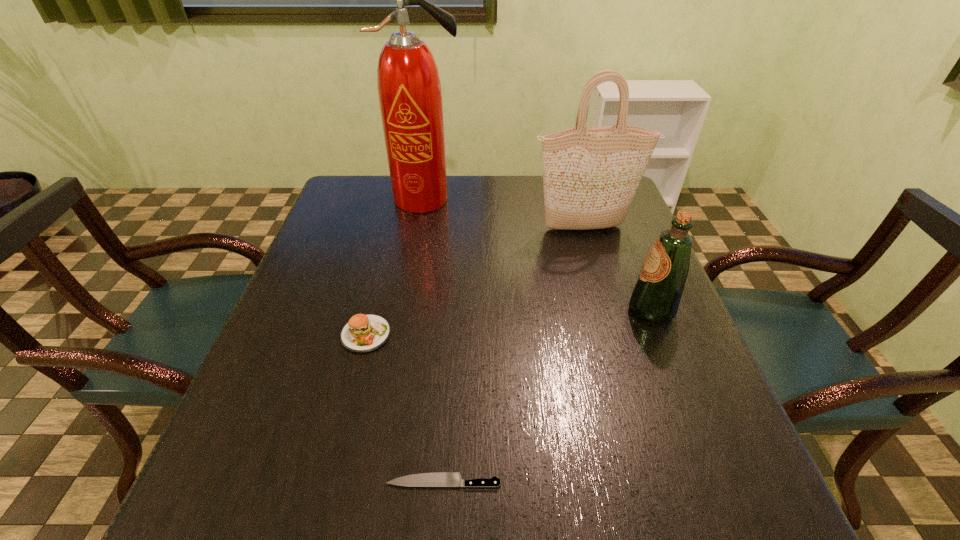
At what (x,y) coordinates should I click in order to perform the action: click on vacant point located between the fourth tallest object and the tallest object. Please return your answer as a coordinate pair (x, y). Looking at the image, I should click on (396, 267).

Locate an element on the screen. blank region between the shopping bag and the steak knife is located at coordinates (515, 354).

Where is `vacant area between the fourth tallest object and the tallest object`? vacant area between the fourth tallest object and the tallest object is located at coordinates (396, 267).

At what (x,y) coordinates should I click in order to perform the action: click on free space between the patty and the tallest object. Please return your answer as a coordinate pair (x, y). The width and height of the screenshot is (960, 540). Looking at the image, I should click on (396, 267).

Where is `free point between the fourth shortest object and the fourth tallest object`? This screenshot has height=540, width=960. free point between the fourth shortest object and the fourth tallest object is located at coordinates (475, 281).

I want to click on vacant space that's between the fourth nearest object and the third tallest object, so click(618, 268).

Choose which object is the fourth nearest neighbor to the patty. Please provide its 2D coordinates. Your answer should be formatted as a tuple, i.e. [(x, y)], where the tuple contains the x and y coordinates of a point satisfying the conditions above.

[(656, 295)]

Where is `object that is the second nearest to the patty`? This screenshot has width=960, height=540. object that is the second nearest to the patty is located at coordinates (409, 89).

The height and width of the screenshot is (540, 960). Find the location of `vacant region that satisfies the following two spatial constraints: 1. on the back side of the second tallest object; 2. on the right side of the second shortest object`. vacant region that satisfies the following two spatial constraints: 1. on the back side of the second tallest object; 2. on the right side of the second shortest object is located at coordinates (393, 228).

You are a GUI agent. You are given a task and a screenshot of the screen. Output one action in this format:
    pyautogui.click(x=<x>, y=<y>)
    Task: Click on the free spot that satisfies the following two spatial constraints: 1. on the back side of the patty; 2. on the left side of the fire extinguisher
    The width and height of the screenshot is (960, 540).
    Given the screenshot: What is the action you would take?
    pyautogui.click(x=399, y=199)